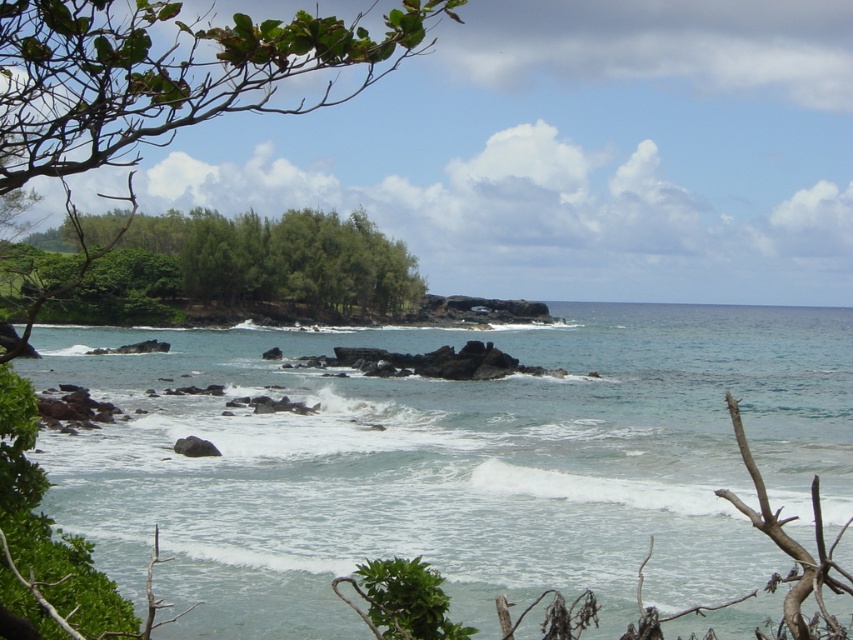
Question: Is clear blue water at center above green leafy trees at center?

Choices:
 (A) yes
 (B) no

Answer: (B)

Question: Estimate the real-world distances between objects in this image. Which object is closer to the green leafy trees at center?

Choices:
 (A) green leafy tree at upper left
 (B) clear blue water at center

Answer: (A)

Question: Which point is closer to the camera taking this photo?

Choices:
 (A) (206, 248)
 (B) (252, 451)
 (C) (366, 67)

Answer: (B)

Question: Is green leafy tree at upper left smaller than green leafy trees at center?

Choices:
 (A) no
 (B) yes

Answer: (A)

Question: Which object is closer to the camera taking this photo?

Choices:
 (A) clear blue water at center
 (B) green leafy trees at center
 (C) green leafy tree at upper left

Answer: (C)

Question: Can you confirm if clear blue water at center is smaller than green leafy tree at upper left?

Choices:
 (A) yes
 (B) no

Answer: (A)